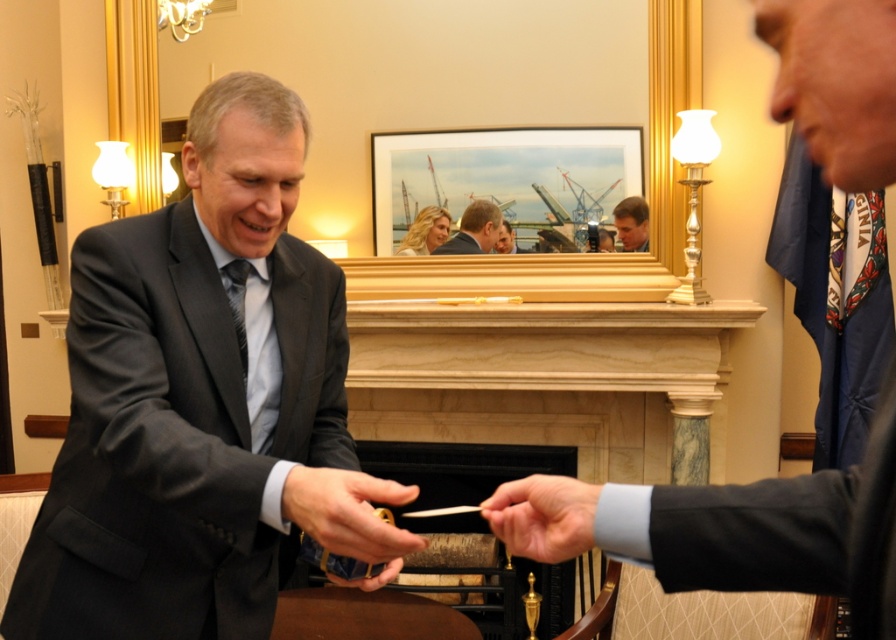
Is smooth skin hand at center smaller than smooth skin face at center?

No, smooth skin hand at center is not smaller than smooth skin face at center.

Does point (506, 522) come behind point (642, 221)?

No.

Find the location of `smooth skin hand at center`. smooth skin hand at center is located at coordinates (543, 516).

How distant is gold-framed photograph at upper center from matte black suit at center?

They are 26.56 centimeters apart.

Does gold-framed photograph at upper center have a greater width compared to matte black suit at center?

Indeed, gold-framed photograph at upper center has a greater width compared to matte black suit at center.

Between point (526, 205) and point (464, 252), which one is positioned behind?

Positioned behind is point (464, 252).

In order to click on gold-framed photograph at upper center in this screenshot , I will do `click(505, 179)`.

Can you confirm if dark gray suit at center is positioned below matte black suit at center?

Yes.

Who is more distant from viewer, (322, 525) or (466, 250)?

The point (466, 250) is more distant.

This screenshot has width=896, height=640. Find the location of `dark gray suit at center`. dark gray suit at center is located at coordinates (202, 404).